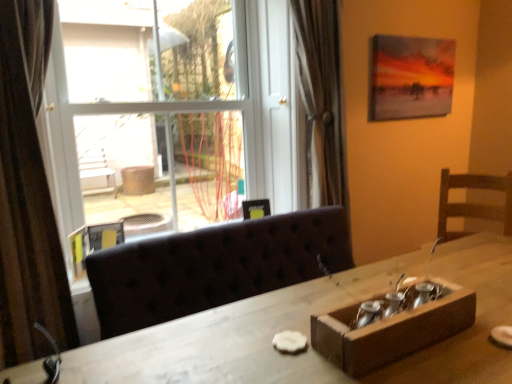
Question: From a real-world perspective, is brown textured curtain at left beneath wooden table at center?

Choices:
 (A) yes
 (B) no

Answer: (B)

Question: Can you confirm if brown textured curtain at left is shorter than wooden table at center?

Choices:
 (A) yes
 (B) no

Answer: (B)

Question: Is there a large distance between brown textured curtain at left and wooden table at center?

Choices:
 (A) yes
 (B) no

Answer: (A)

Question: Is brown textured curtain at left in contact with wooden table at center?

Choices:
 (A) no
 (B) yes

Answer: (A)

Question: Is brown textured curtain at left looking in the opposite direction of wooden table at center?

Choices:
 (A) no
 (B) yes

Answer: (A)

Question: Is brown textured curtain at left oriented towards wooden table at center?

Choices:
 (A) no
 (B) yes

Answer: (A)

Question: From the image's perspective, is transparent glass window at upper left below wooden box at lower right?

Choices:
 (A) no
 (B) yes

Answer: (A)

Question: From a real-world perspective, is transparent glass window at upper left physically above wooden box at lower right?

Choices:
 (A) no
 (B) yes

Answer: (B)

Question: Is wooden box at lower right at the back of transparent glass window at upper left?

Choices:
 (A) yes
 (B) no

Answer: (B)

Question: Is transparent glass window at upper left thinner than wooden box at lower right?

Choices:
 (A) no
 (B) yes

Answer: (A)

Question: Is transparent glass window at upper left next to wooden box at lower right?

Choices:
 (A) no
 (B) yes

Answer: (A)

Question: Can you confirm if transparent glass window at upper left is positioned to the right of wooden box at lower right?

Choices:
 (A) no
 (B) yes

Answer: (A)

Question: Does matte canvas painting at upper right, the first picture frame from the back, come in front of transparent glass window at upper left?

Choices:
 (A) no
 (B) yes

Answer: (A)